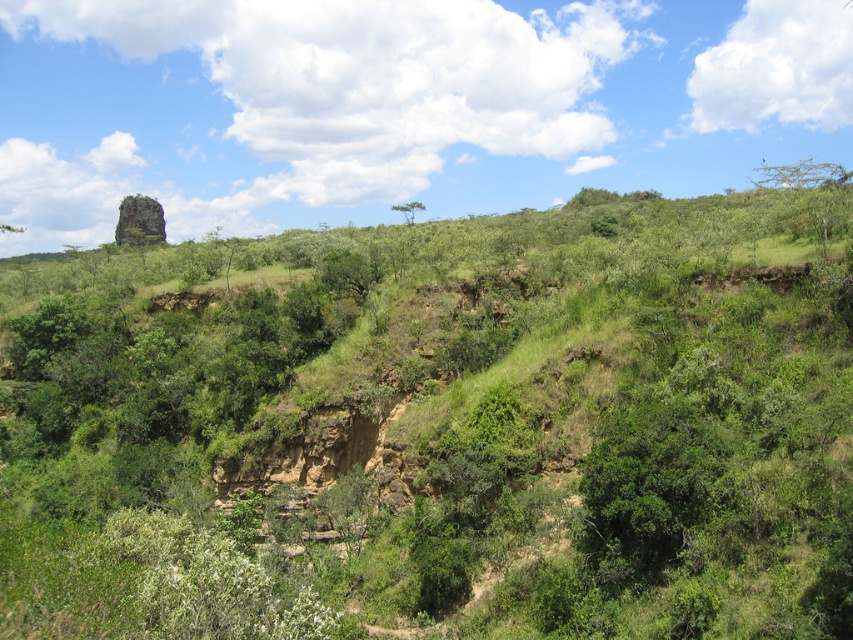
Question: Which point appears closest to the camera in this image?

Choices:
 (A) 776,172
 (B) 422,205

Answer: (B)

Question: Is green leafy tree at upper right to the right of green leafy tree at center from the viewer's perspective?

Choices:
 (A) no
 (B) yes

Answer: (B)

Question: Observing the image, what is the correct spatial positioning of green leafy tree at upper right in reference to green leafy tree at center?

Choices:
 (A) left
 (B) right

Answer: (B)

Question: Can you confirm if green leafy tree at upper right is positioned below green leafy tree at center?

Choices:
 (A) yes
 (B) no

Answer: (B)